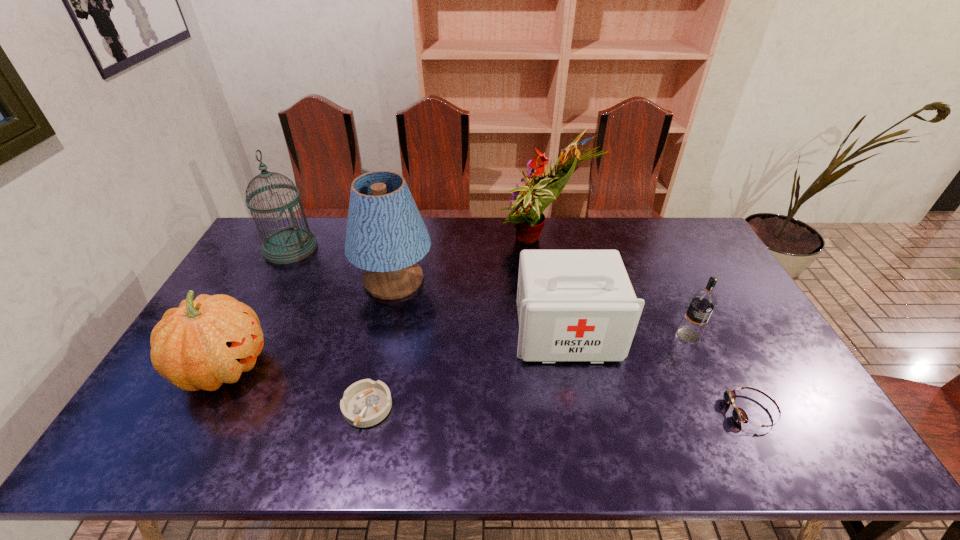
In the image, there is a desktop. Where is `free space at the near edge`? free space at the near edge is located at coordinates (395, 451).

Identify the location of vacant space at the far left corner of the desktop. (260, 233).

Locate an element on the screen. The image size is (960, 540). blank space at the far right corner is located at coordinates (665, 246).

Locate an element on the screen. This screenshot has width=960, height=540. free point between the lampshade and the ashtray is located at coordinates (381, 344).

The height and width of the screenshot is (540, 960). Identify the location of vacant space in between the ashtray and the goggles. (560, 409).

Where is `free spot between the first-aid kit and the goggles`? Image resolution: width=960 pixels, height=540 pixels. free spot between the first-aid kit and the goggles is located at coordinates (659, 372).

Where is `free space between the third shortest object and the ashtray`? The image size is (960, 540). free space between the third shortest object and the ashtray is located at coordinates (528, 372).

Identify the location of empty space between the pumpkin and the bouquet. Image resolution: width=960 pixels, height=540 pixels. (383, 305).

The width and height of the screenshot is (960, 540). Find the location of `free spot between the ashtray and the lampshade`. free spot between the ashtray and the lampshade is located at coordinates (x=381, y=344).

You are a GUI agent. You are given a task and a screenshot of the screen. Output one action in this format:
    pyautogui.click(x=<x>, y=<y>)
    Task: Click on the object that is the second nearest to the ashtray
    Image resolution: width=960 pixels, height=540 pixels.
    Given the screenshot: What is the action you would take?
    pyautogui.click(x=386, y=236)